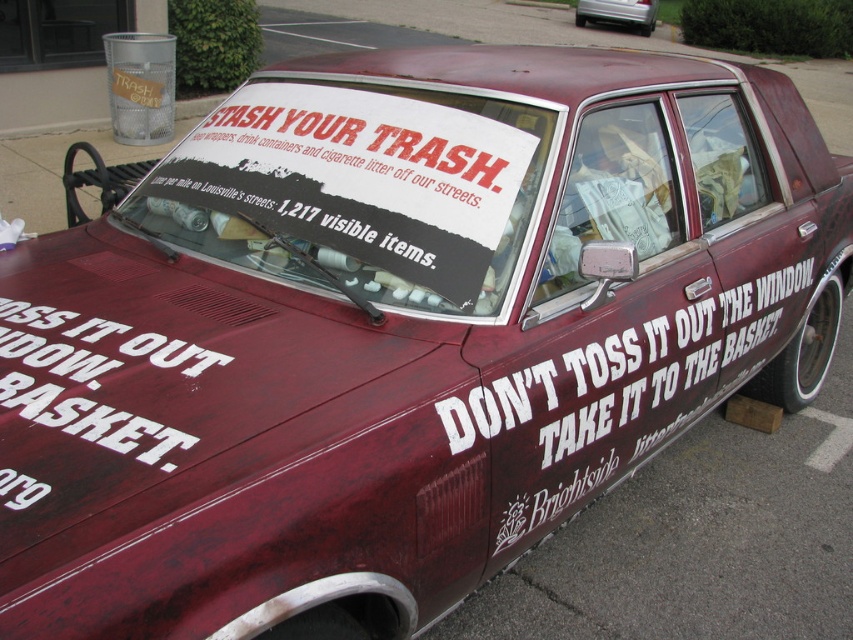
You are a pedestrian standing in front of the maroon matte car at center. You want to read the white painted text at lower left. Do you need to look down to see it?

The white painted text at lower left is positioned under the maroon matte car at center, so yes, you need to look down to see it since it is located below the car.

In the scene shown: You are a passerby who wants to read the white painted text at lower left on the maroon matte car at center. Can you read it easily from the sidewalk?

The white painted text at lower left is narrower than the maroon matte car at center, so it might be challenging to read the text from the sidewalk unless you get closer.

You are standing in front of the maroon sedan with litter prevention messages. There is a point marked at coordinates [80,332] on the car. If you want to touch this point without moving your feet, can you reach it given your arm length is 2.5 feet?

The point at [80,332] is 6.70 feet away from you. Since your arm length is only 2.5 feet, you cannot reach it without moving your feet.